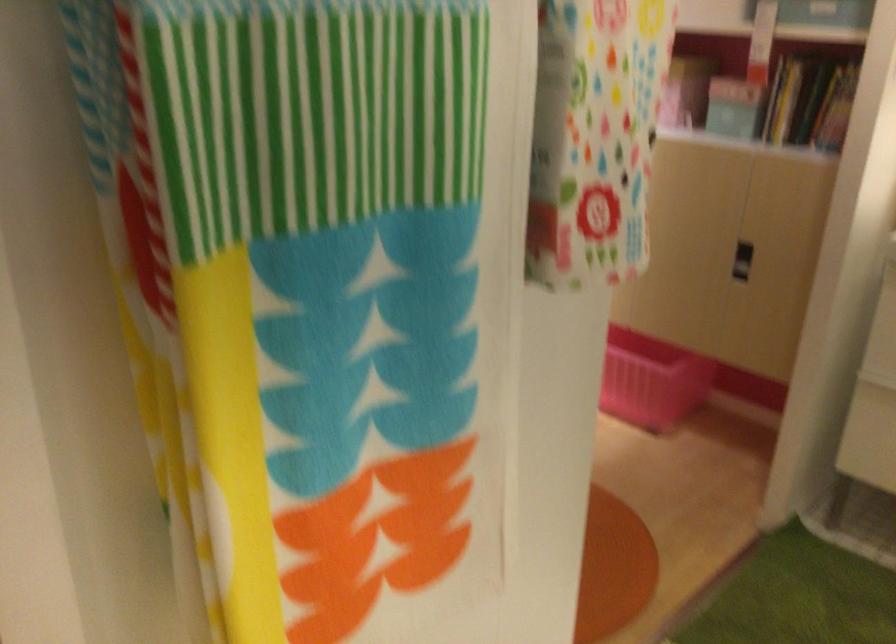
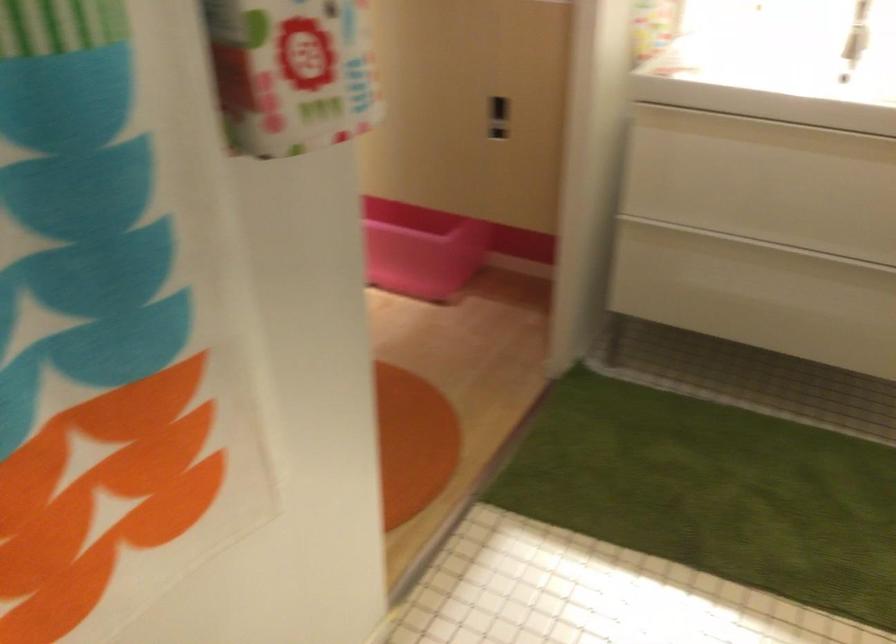
The point at (745,259) is marked in the first image. Where is the corresponding point in the second image?

(497, 118)